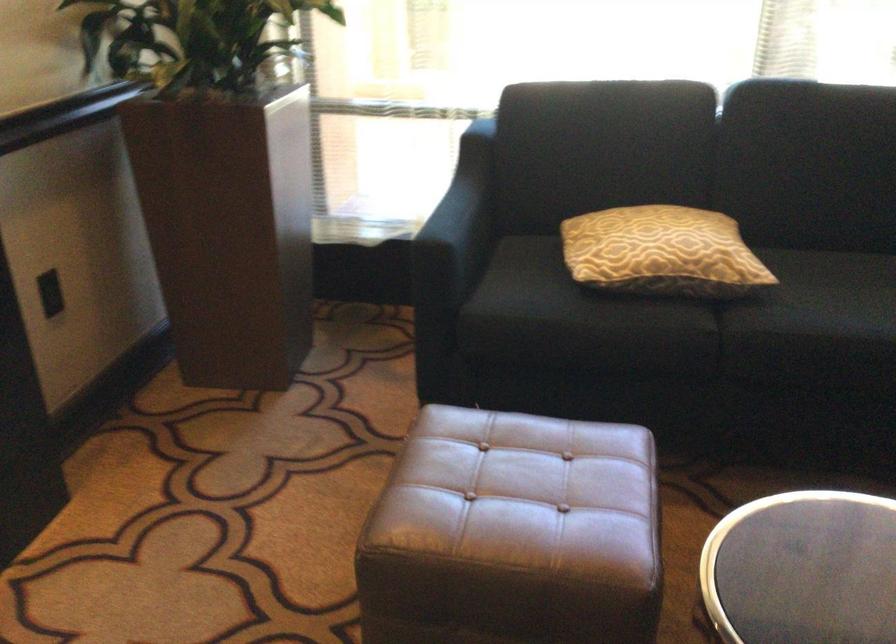
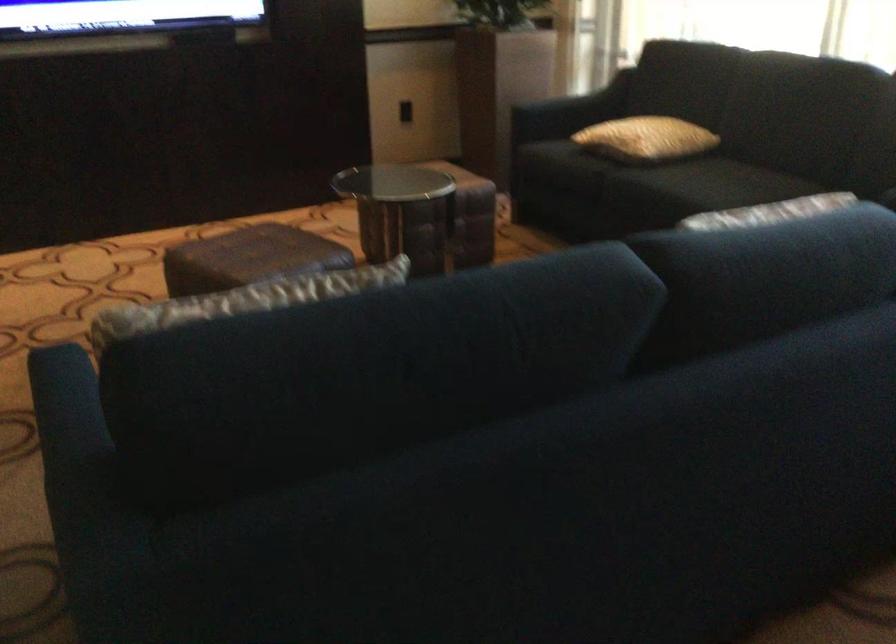
In the second image, find the point that corresponds to (733,256) in the first image.

(645, 138)